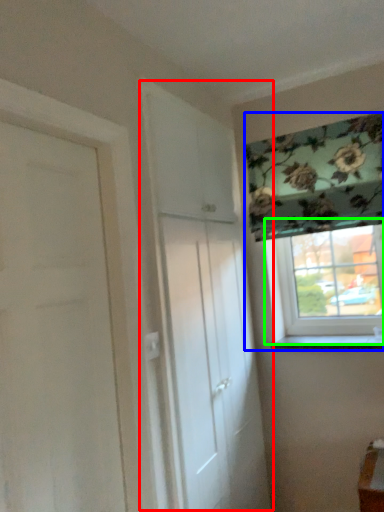
Question: Estimate the real-world distances between objects in this image. Which object is closer to door (highlighted by a red box), window (highlighted by a blue box) or window (highlighted by a green box)?

Choices:
 (A) window
 (B) window

Answer: (A)